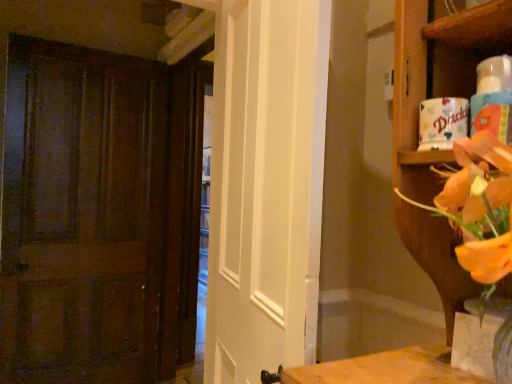
Question: Can you confirm if translucent glass vase at lower right is thinner than white glossy door at center?

Choices:
 (A) no
 (B) yes

Answer: (B)

Question: Are translucent glass vase at lower right and white glossy door at center making contact?

Choices:
 (A) no
 (B) yes

Answer: (A)

Question: Is translucent glass vase at lower right to the right of white glossy door at center from the viewer's perspective?

Choices:
 (A) yes
 (B) no

Answer: (A)

Question: Is translucent glass vase at lower right positioned beyond the bounds of white glossy door at center?

Choices:
 (A) yes
 (B) no

Answer: (A)

Question: Is translucent glass vase at lower right taller than white glossy door at center?

Choices:
 (A) no
 (B) yes

Answer: (A)

Question: From the image's perspective, is translucent glass vase at lower right below white glossy door at center?

Choices:
 (A) no
 (B) yes

Answer: (B)

Question: Is wooden shelf at upper right behind white glossy door at center?

Choices:
 (A) yes
 (B) no

Answer: (B)

Question: Can you confirm if wooden shelf at upper right is shorter than white glossy door at center?

Choices:
 (A) no
 (B) yes

Answer: (B)

Question: From a real-world perspective, is wooden shelf at upper right physically above white glossy door at center?

Choices:
 (A) no
 (B) yes

Answer: (B)

Question: Considering the relative positions of wooden shelf at upper right and white glossy door at center in the image provided, is wooden shelf at upper right to the left of white glossy door at center from the viewer's perspective?

Choices:
 (A) yes
 (B) no

Answer: (B)

Question: Considering the relative sizes of wooden shelf at upper right and white glossy door at center in the image provided, is wooden shelf at upper right thinner than white glossy door at center?

Choices:
 (A) yes
 (B) no

Answer: (B)

Question: From a real-world perspective, is wooden shelf at upper right under white glossy door at center?

Choices:
 (A) yes
 (B) no

Answer: (B)

Question: Is white glossy door at center outside wooden door at left?

Choices:
 (A) yes
 (B) no

Answer: (A)